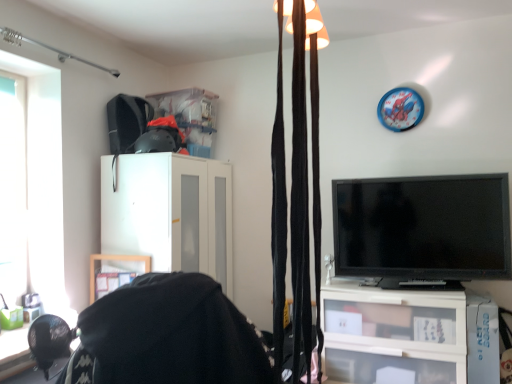
Question: From a real-world perspective, is transparent glass window at left physically above black velvet curtains at upper center?

Choices:
 (A) no
 (B) yes

Answer: (B)

Question: Is black velvet curtains at upper center located within transparent glass window at left?

Choices:
 (A) yes
 (B) no

Answer: (B)

Question: From a real-world perspective, is transparent glass window at left physically below black velvet curtains at upper center?

Choices:
 (A) yes
 (B) no

Answer: (B)

Question: Is transparent glass window at left to the right of black velvet curtains at upper center from the viewer's perspective?

Choices:
 (A) yes
 (B) no

Answer: (B)

Question: Is transparent glass window at left oriented towards black velvet curtains at upper center?

Choices:
 (A) no
 (B) yes

Answer: (A)

Question: From the image's perspective, is black velvet curtains at upper center above or below transparent glass window at left?

Choices:
 (A) below
 (B) above

Answer: (A)

Question: From their relative heights in the image, would you say black velvet curtains at upper center is taller or shorter than transparent glass window at left?

Choices:
 (A) tall
 (B) short

Answer: (B)

Question: From a real-world perspective, relative to transparent glass window at left, is black velvet curtains at upper center vertically above or below?

Choices:
 (A) below
 (B) above

Answer: (A)

Question: Does point (302, 185) appear closer or farther from the camera than point (1, 206)?

Choices:
 (A) farther
 (B) closer

Answer: (B)

Question: From the image's perspective, relative to transparent glass window at left, is black fabric bean bag chair at lower left above or below?

Choices:
 (A) above
 (B) below

Answer: (B)

Question: Visually, is black fabric bean bag chair at lower left positioned to the left or to the right of transparent glass window at left?

Choices:
 (A) left
 (B) right

Answer: (B)

Question: In terms of width, does black fabric bean bag chair at lower left look wider or thinner when compared to transparent glass window at left?

Choices:
 (A) wide
 (B) thin

Answer: (A)

Question: Looking at the image, does black fabric bean bag chair at lower left seem bigger or smaller compared to transparent glass window at left?

Choices:
 (A) small
 (B) big

Answer: (B)

Question: Relative to transparent glass window at left, is white matte cabinet at center in front or behind?

Choices:
 (A) behind
 (B) front

Answer: (A)

Question: Looking at the image, does white matte cabinet at center seem bigger or smaller compared to transparent glass window at left?

Choices:
 (A) small
 (B) big

Answer: (B)